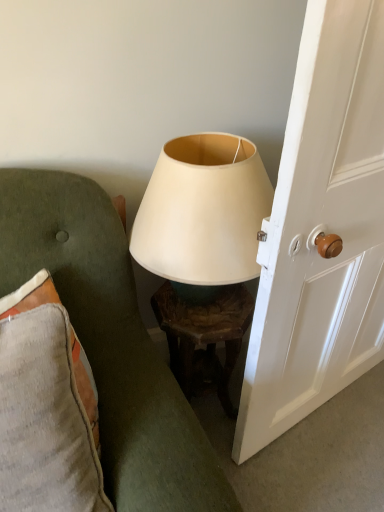
This screenshot has height=512, width=384. What are the coordinates of `vacant point above wooden textured table at center (from a real-world perspective)` in the screenshot? It's located at (211, 306).